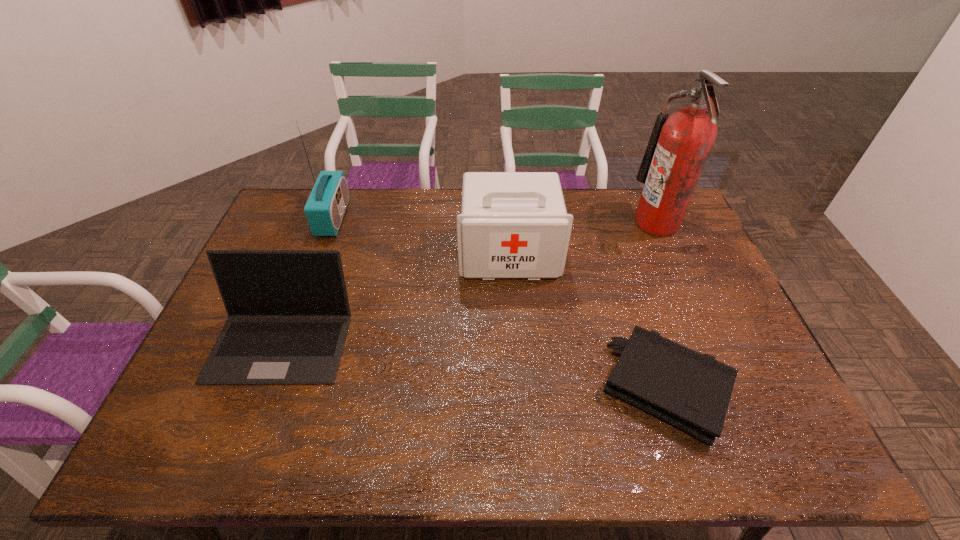
Locate an element on the screen. This screenshot has width=960, height=540. free space that satisfies the following two spatial constraints: 1. on the screen of the laptop; 2. on the right side of the Bible is located at coordinates (264, 387).

Image resolution: width=960 pixels, height=540 pixels. Find the location of `vacant region that satisfies the following two spatial constraints: 1. on the front of the fire extinguisher near the operation label; 2. on the screen of the laptop`. vacant region that satisfies the following two spatial constraints: 1. on the front of the fire extinguisher near the operation label; 2. on the screen of the laptop is located at coordinates (708, 341).

What are the coordinates of `free region that satisfies the following two spatial constraints: 1. on the front panel of the second tallest object; 2. on the screen of the second shortest object` in the screenshot? It's located at (288, 341).